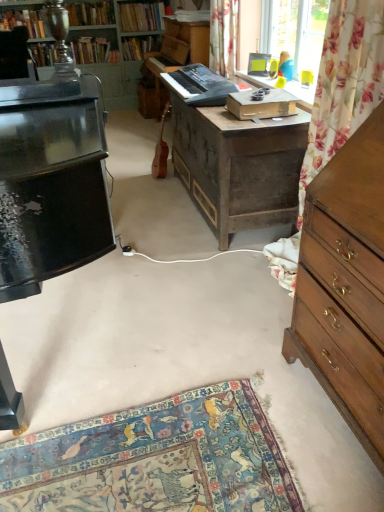
Find the location of `vacant space situated on the left part of wooden chest of drawers at right`. vacant space situated on the left part of wooden chest of drawers at right is located at coordinates (236, 404).